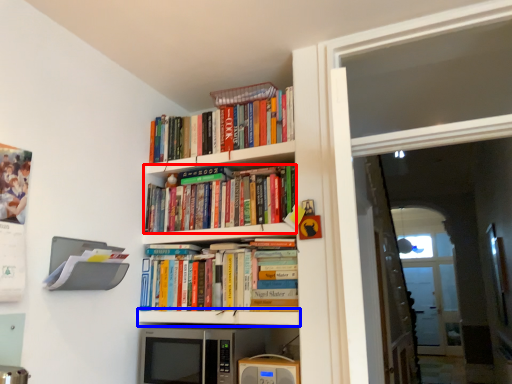
Question: Among these objects, which one is farthest to the camera, book (highlighted by a red box) or shelf (highlighted by a blue box)?

Choices:
 (A) book
 (B) shelf

Answer: (A)